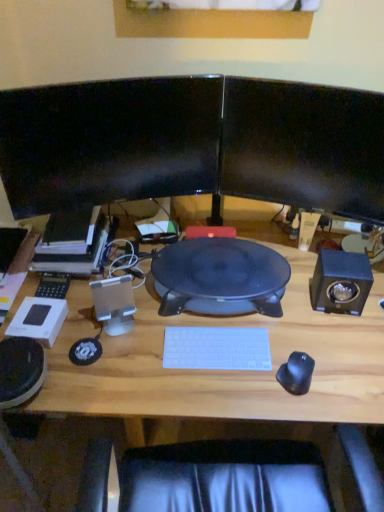
Question: From the image's perspective, is black rubberized mouse at right above or below wooden desk at center?

Choices:
 (A) below
 (B) above

Answer: (B)

Question: Is black rubberized mouse at right bigger or smaller than wooden desk at center?

Choices:
 (A) small
 (B) big

Answer: (A)

Question: Estimate the real-world distances between objects in this image. Which object is closer to the black rubberized mouse at right?

Choices:
 (A) black glossy monitor at upper center, which ranks as the second computer monitor in left-to-right order
 (B) white plastic keyboard at center
 (C) black glossy monitor at upper left, which is the 2th computer monitor in right-to-left order
 (D) wooden desk at center
 (E) silver metallic speaker at left, marked as the first speaker in a left-to-right arrangement

Answer: (B)

Question: Based on their relative distances, which object is nearer to the white plastic keyboard at center?

Choices:
 (A) black glossy monitor at upper left, which is the 2th computer monitor in right-to-left order
 (B) silver metallic speaker at left, placed as the 2th speaker when sorted from right to left
 (C) wooden desk at center
 (D) satin black speaker at right, which ranks as the 1th speaker in right-to-left order
 (E) black glossy monitor at upper center, which ranks as the second computer monitor in left-to-right order

Answer: (C)